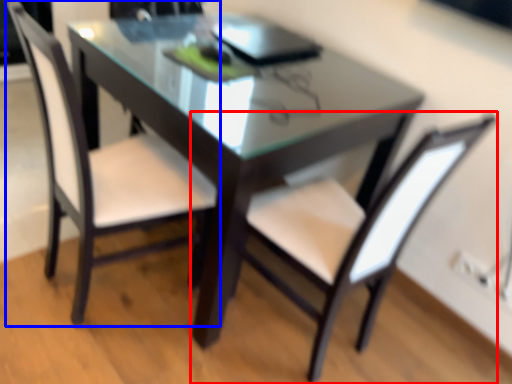
Question: Which of the following is the farthest to the observer, chair (highlighted by a red box) or chair (highlighted by a blue box)?

Choices:
 (A) chair
 (B) chair

Answer: (B)